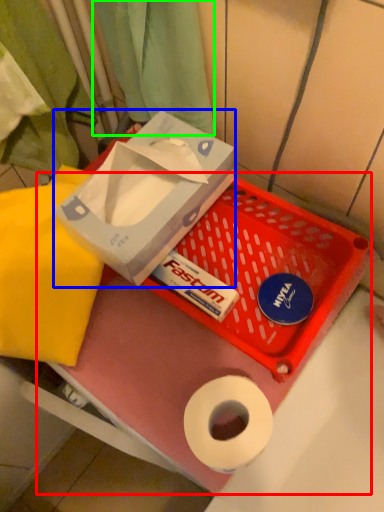
Question: Considering the real-world distances, which object is farthest from box (highlighted by a red box)? box (highlighted by a blue box) or curtain (highlighted by a green box)?

Choices:
 (A) box
 (B) curtain

Answer: (B)